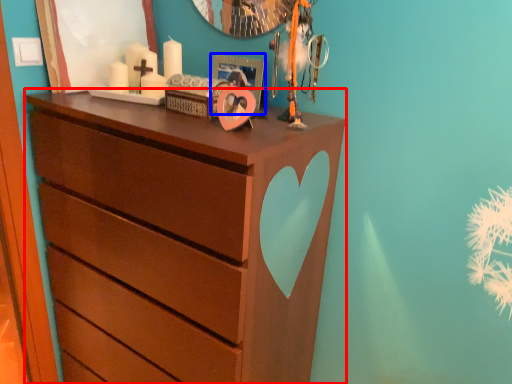
Question: Among these objects, which one is farthest to the camera, chest of drawers (highlighted by a red box) or picture frame (highlighted by a blue box)?

Choices:
 (A) chest of drawers
 (B) picture frame

Answer: (B)